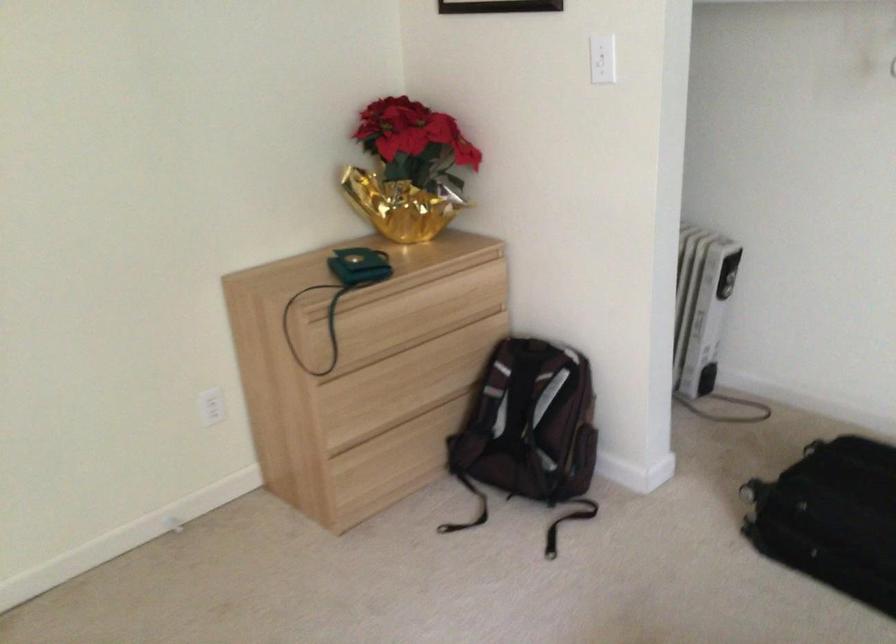
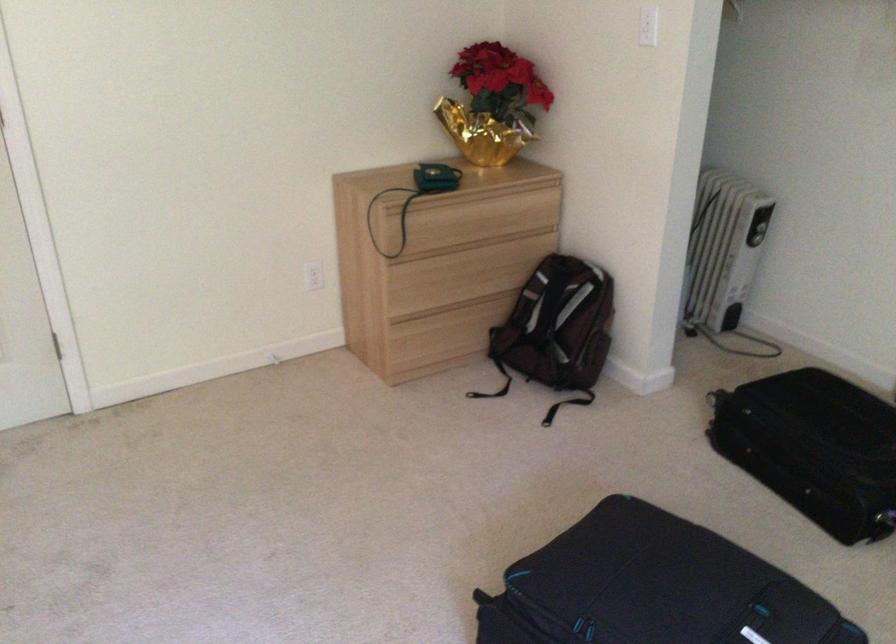
In the second image, find the point that corresponds to (376,389) in the first image.

(435, 277)